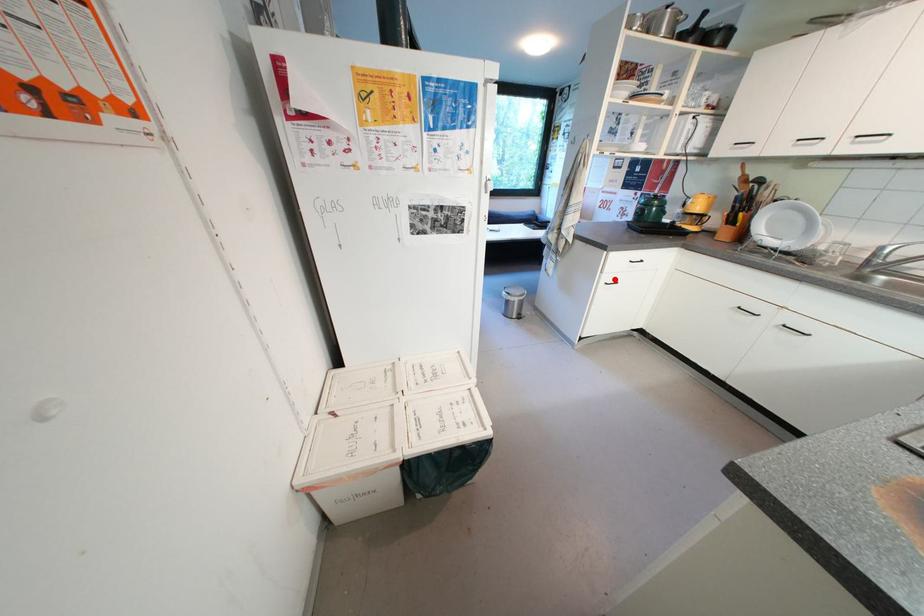
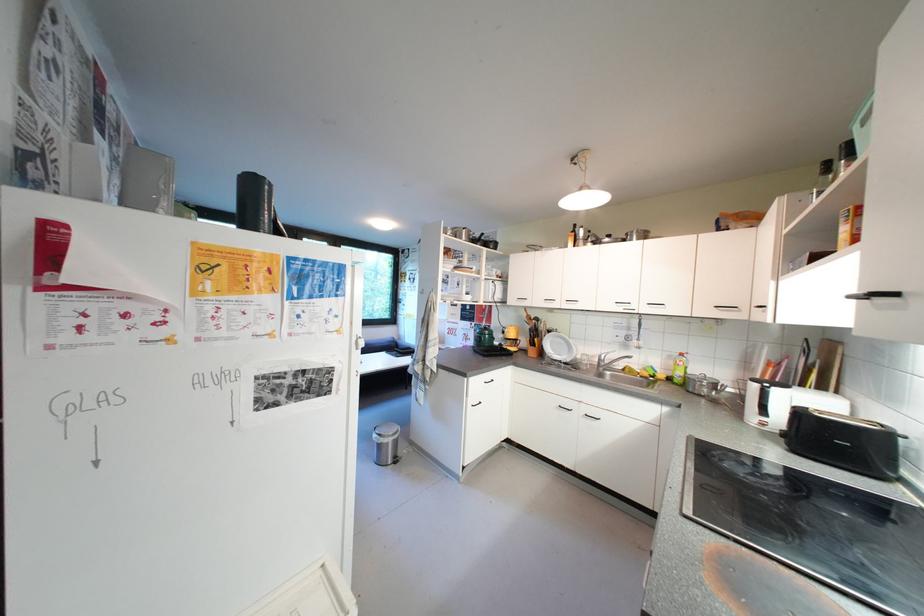
Question: I am providing you with two images of the same scene from different viewpoints. A red point is shown in image1. For the corresponding object point in image2, is it positioned nearer or farther from the camera?

Choices:
 (A) Nearer
 (B) Farther

Answer: (B)